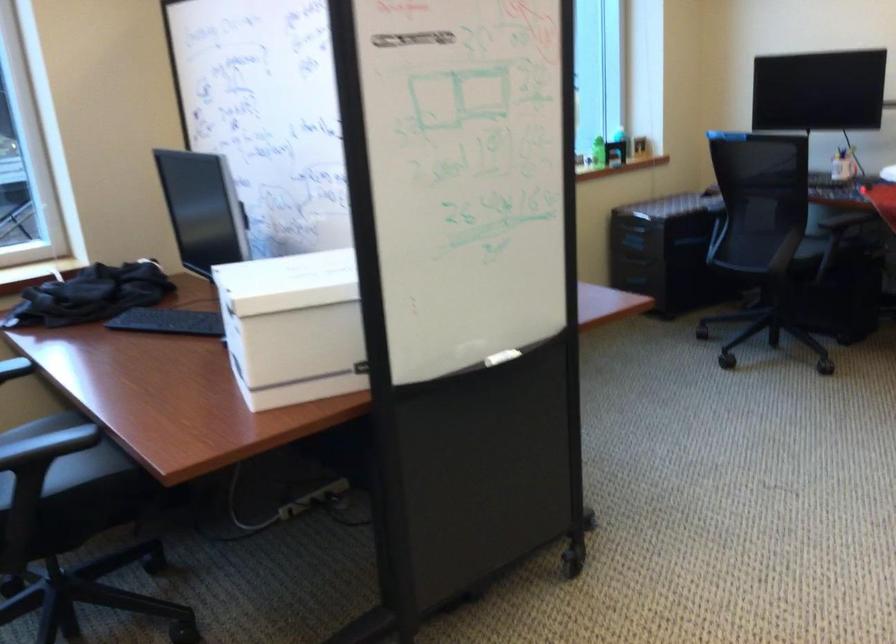
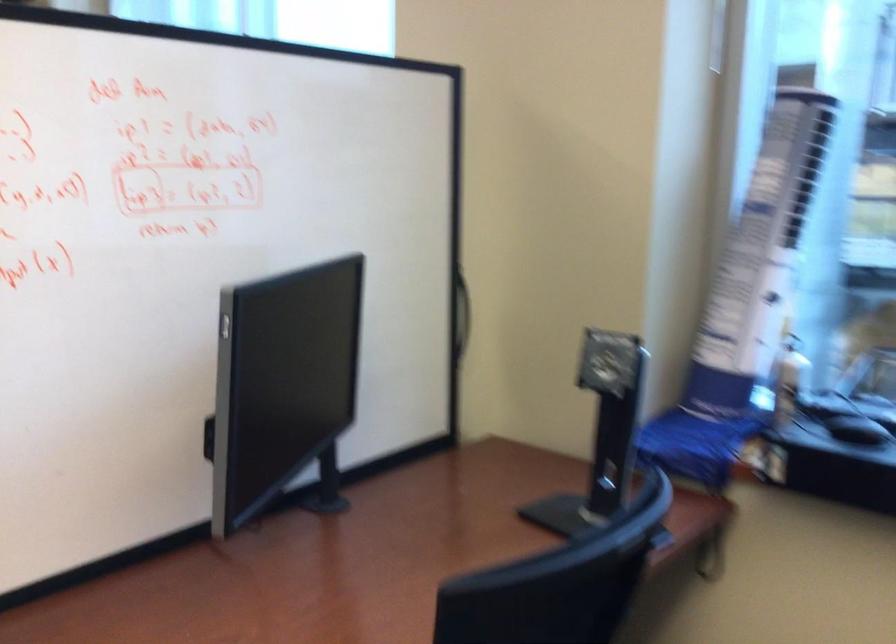
Where in the second image is the point corresponding to point (158, 192) from the first image?

(461, 313)